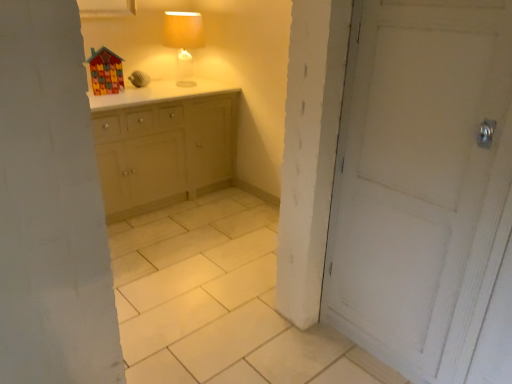
What do you see at coordinates (419, 179) in the screenshot? The image size is (512, 384). I see `white matte door at right` at bounding box center [419, 179].

Where is `white matte door at right`? Image resolution: width=512 pixels, height=384 pixels. white matte door at right is located at coordinates (419, 179).

This screenshot has width=512, height=384. Identify the location of matte yellow fabric lampshade at upper center. (184, 41).

Measure the distance between point (x=190, y=61) and camera.

A distance of 3.80 meters exists between point (x=190, y=61) and camera.

What do you see at coordinates (184, 41) in the screenshot? The width and height of the screenshot is (512, 384). I see `matte yellow fabric lampshade at upper center` at bounding box center [184, 41].

Where is `white matte door at right`? white matte door at right is located at coordinates (419, 179).

Can you confirm if white matte door at right is positioned to the left of matte yellow fabric lampshade at upper center?

No.

Is the depth of white matte door at right less than that of matte yellow fabric lampshade at upper center?

Yes, white matte door at right is closer to the viewer.

Is point (414, 29) closer to viewer compared to point (186, 22)?

Yes.

From the image's perspective, is white matte door at right positioned above or below matte yellow fabric lampshade at upper center?

white matte door at right is below matte yellow fabric lampshade at upper center.

From a real-world perspective, who is located higher, white matte door at right or matte yellow fabric lampshade at upper center?

matte yellow fabric lampshade at upper center is physically above.

Which of these two, white matte door at right or matte yellow fabric lampshade at upper center, is wider?

Wider between the two is white matte door at right.

Can you confirm if white matte door at right is taller than matte yellow fabric lampshade at upper center?

Correct, white matte door at right is much taller as matte yellow fabric lampshade at upper center.

Is white matte door at right smaller than matte yellow fabric lampshade at upper center?

No, white matte door at right is not smaller than matte yellow fabric lampshade at upper center.

Would you say white matte door at right is outside matte yellow fabric lampshade at upper center?

Absolutely, white matte door at right is external to matte yellow fabric lampshade at upper center.

Is white matte door at right directly adjacent to matte yellow fabric lampshade at upper center?

white matte door at right and matte yellow fabric lampshade at upper center are not in contact.

Is matte yellow fabric lampshade at upper center at the back of white matte door at right?

No.

How distant is white matte door at right from matte yellow fabric lampshade at upper center?

8.05 feet.

You are a GUI agent. You are given a task and a screenshot of the screen. Output one action in this format:
    pyautogui.click(x=<x>, y=<y>)
    Task: Click on the table lamp above the white matte door at right (from a real-world perspective)
    The image size is (512, 384).
    Given the screenshot: What is the action you would take?
    pyautogui.click(x=184, y=41)

Is matte yellow fabric lampshade at upper center to the left or to the right of white matte door at right in the image?

Based on their positions, matte yellow fabric lampshade at upper center is located to the left of white matte door at right.

Considering the positions of objects matte yellow fabric lampshade at upper center and white matte door at right in the image provided, who is in front, matte yellow fabric lampshade at upper center or white matte door at right?

white matte door at right.

Does point (170, 18) appear closer or farther from the camera than point (405, 158)?

Point (170, 18) is farther from the camera than point (405, 158).

From the image's perspective, would you say matte yellow fabric lampshade at upper center is shown under white matte door at right?

No, from the image's perspective, matte yellow fabric lampshade at upper center is not beneath white matte door at right.

From a real-world perspective, is matte yellow fabric lampshade at upper center on top of white matte door at right?

Yes, from a real-world perspective, matte yellow fabric lampshade at upper center is on top of white matte door at right.

Which object is thinner, matte yellow fabric lampshade at upper center or white matte door at right?

With smaller width is matte yellow fabric lampshade at upper center.

Between matte yellow fabric lampshade at upper center and white matte door at right, which one has more height?

Standing taller between the two is white matte door at right.

Considering the sizes of objects matte yellow fabric lampshade at upper center and white matte door at right in the image provided, who is bigger, matte yellow fabric lampshade at upper center or white matte door at right?

With larger size is white matte door at right.

Does matte yellow fabric lampshade at upper center contain white matte door at right?

No.

Is matte yellow fabric lampshade at upper center placed right next to white matte door at right?

No, matte yellow fabric lampshade at upper center is not making contact with white matte door at right.

Is matte yellow fabric lampshade at upper center oriented away from white matte door at right?

No, matte yellow fabric lampshade at upper center is not facing the opposite direction of white matte door at right.

How far apart are matte yellow fabric lampshade at upper center and white matte door at right?

matte yellow fabric lampshade at upper center is 8.05 feet from white matte door at right.

The width and height of the screenshot is (512, 384). In the image, there is a white matte door at right. What are the coordinates of `table lamp above it (from the image's perspective)` in the screenshot? It's located at (184, 41).

Identify the location of table lamp above the white matte door at right (from the image's perspective). This screenshot has width=512, height=384. (184, 41).

In order to click on door that appears below the matte yellow fabric lampshade at upper center (from the image's perspective) in this screenshot , I will do `click(419, 179)`.